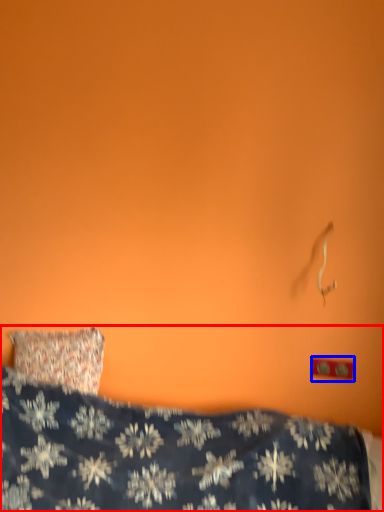
Question: Which object is closer to the camera taking this photo, bed (highlighted by a red box) or electric outlet (highlighted by a blue box)?

Choices:
 (A) bed
 (B) electric outlet

Answer: (A)